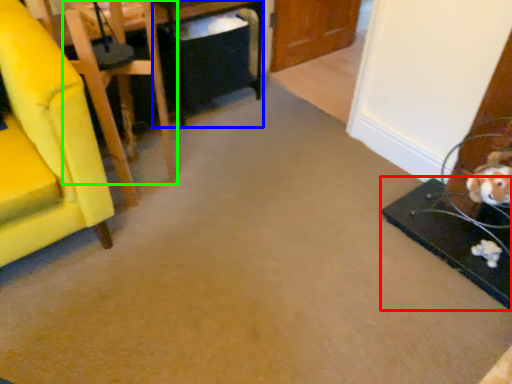
Question: Which object is the closest to the table (highlighted by a red box)? Choose among these: table (highlighted by a blue box) or chair (highlighted by a green box).

Choices:
 (A) table
 (B) chair

Answer: (B)